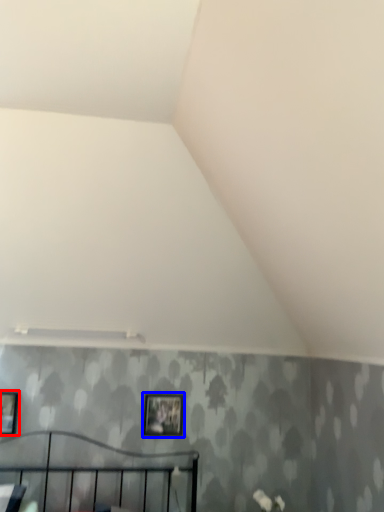
Question: Which point is further to the camera, picture frame (highlighted by a red box) or picture frame (highlighted by a blue box)?

Choices:
 (A) picture frame
 (B) picture frame

Answer: (B)